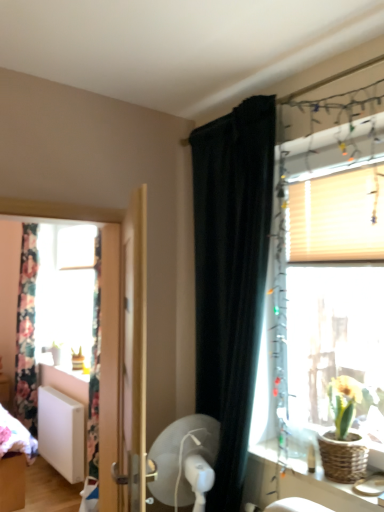
Question: From the image's perspective, does white matte blind at upper right appear lower than wooden door at center?

Choices:
 (A) no
 (B) yes

Answer: (A)

Question: Is white matte blind at upper right at the left side of wooden door at center?

Choices:
 (A) no
 (B) yes

Answer: (A)

Question: Is wooden door at center a part of white matte blind at upper right?

Choices:
 (A) yes
 (B) no

Answer: (B)

Question: Is white matte blind at upper right aimed at wooden door at center?

Choices:
 (A) yes
 (B) no

Answer: (A)

Question: From a real-world perspective, is white matte blind at upper right physically above wooden door at center?

Choices:
 (A) yes
 (B) no

Answer: (A)

Question: Can you confirm if white matte blind at upper right is thinner than wooden door at center?

Choices:
 (A) yes
 (B) no

Answer: (A)

Question: Does black velvet curtain at upper center, the 2th curtain viewed from the back, have a greater width compared to white plastic fan at center?

Choices:
 (A) no
 (B) yes

Answer: (A)

Question: Considering the relative sizes of black velvet curtain at upper center, which appears as the second curtain when viewed from the left, and white plastic fan at center in the image provided, is black velvet curtain at upper center, which appears as the second curtain when viewed from the left, taller than white plastic fan at center?

Choices:
 (A) yes
 (B) no

Answer: (A)

Question: From the image's perspective, is black velvet curtain at upper center, the first curtain positioned from the right, located beneath white plastic fan at center?

Choices:
 (A) no
 (B) yes

Answer: (A)

Question: Is black velvet curtain at upper center, which is the first curtain from front to back, oriented towards white plastic fan at center?

Choices:
 (A) yes
 (B) no

Answer: (A)

Question: From a real-world perspective, is black velvet curtain at upper center, which is the first curtain from front to back, under white plastic fan at center?

Choices:
 (A) no
 (B) yes

Answer: (A)

Question: Considering the relative positions of black velvet curtain at upper center, which is the first curtain from front to back, and white plastic fan at center in the image provided, is black velvet curtain at upper center, which is the first curtain from front to back, to the left of white plastic fan at center from the viewer's perspective?

Choices:
 (A) no
 (B) yes

Answer: (A)

Question: Can you confirm if translucent wood window at right is thinner than white matte blind at upper right?

Choices:
 (A) yes
 (B) no

Answer: (B)